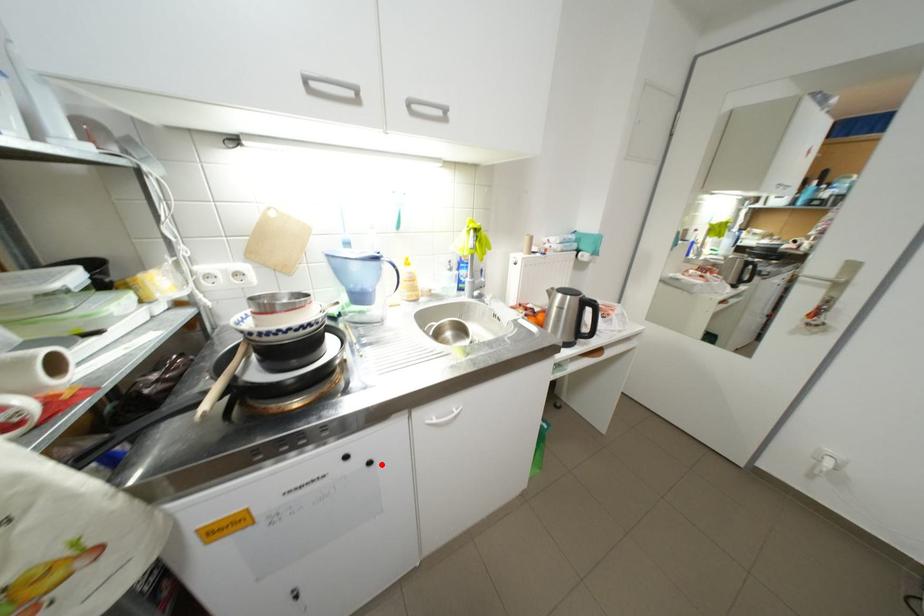
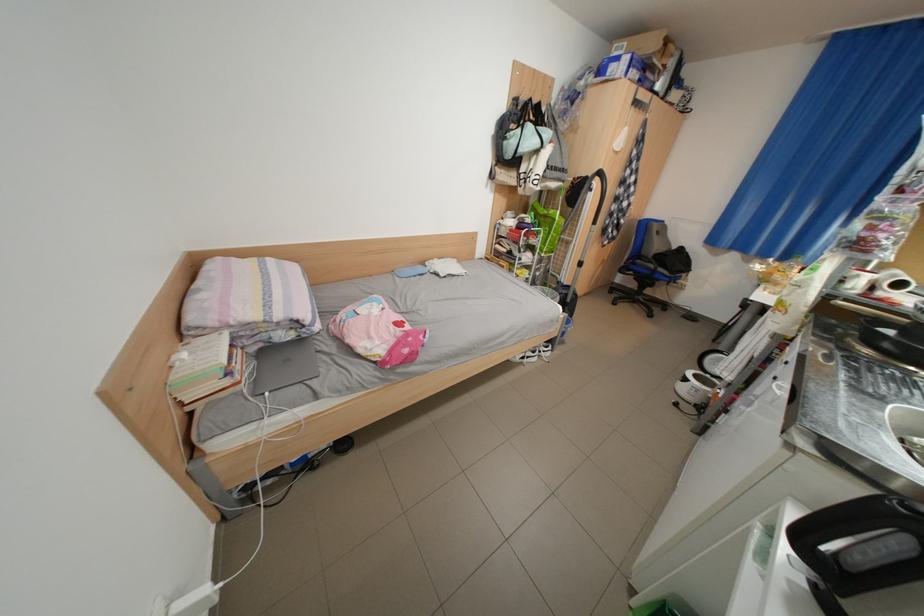
In the second image, find the point that corresponds to the highlighted location in the first image.

(786, 379)